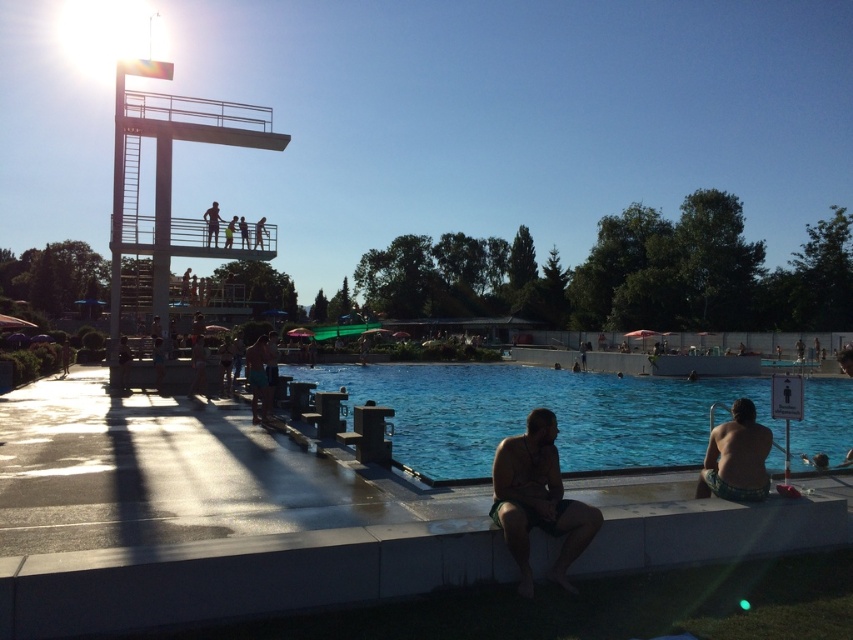
You are a lifeguard on duty and need to assess the visibility of the pool area. Considering the blue glossy water at center and the green textured shorts at lower right, which object takes up more space in the image?

The blue glossy water at center is larger in size than the green textured shorts at lower right, so it takes up more space in the image.

You are standing at the edge of the pool and want to hand a towel to the person wearing the green textured shorts at lower right. Since the blue glossy water at center is in the way, can you still reach them without stepping into the water?

The green textured shorts at lower right is behind the blue glossy water at center, so you can reach them by going around the pool or moving behind the water area to hand the towel without stepping into the water.